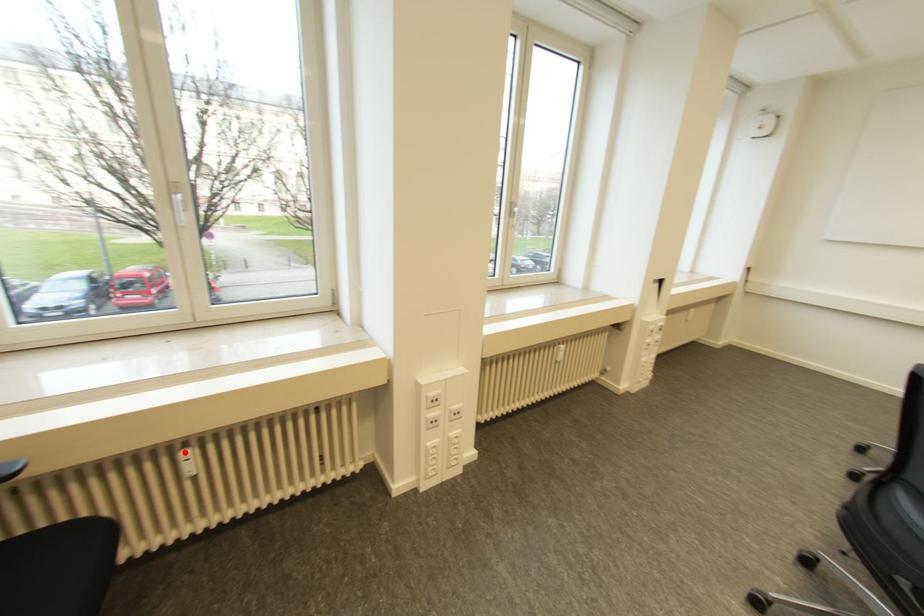
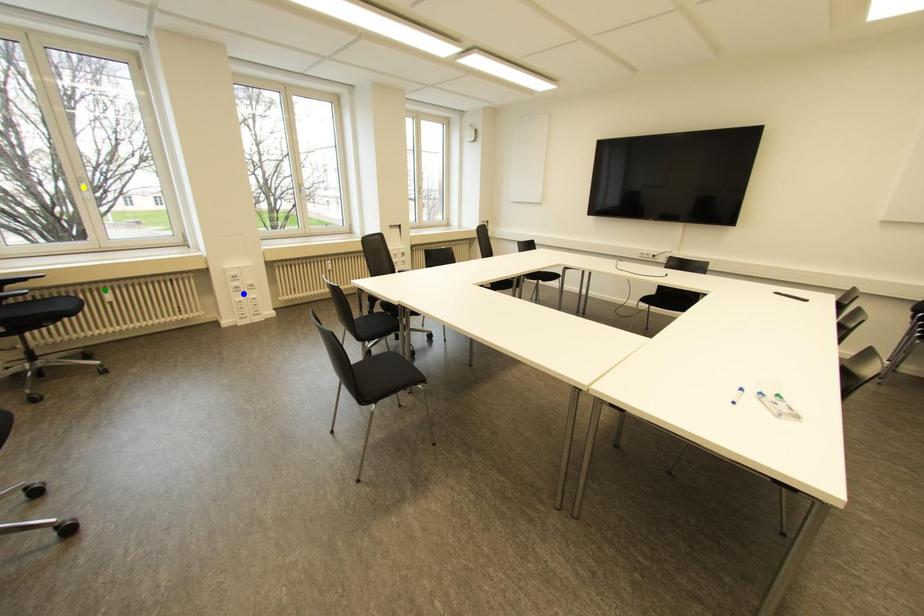
Question: I am providing you with two images of the same scene from different viewpoints. A red point is marked on the first image. You are given multiple points on the second image. Which point in image 2 is actually the same real-world point as the red point in image 1?

Choices:
 (A) green point
 (B) yellow point
 (C) blue point

Answer: (A)